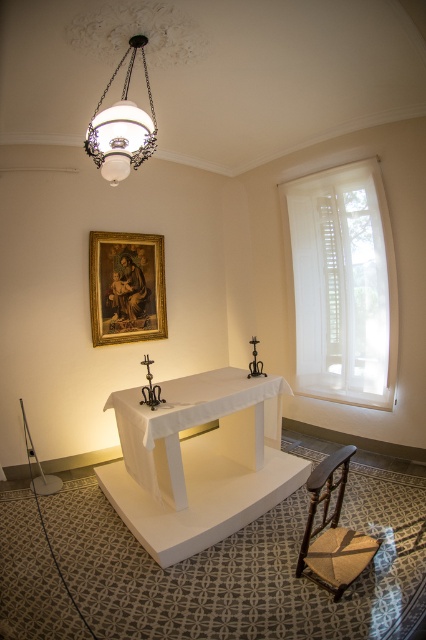
You are standing in the chapel and want to place a small statue between the two points labeled point (98, 275) and point (340, 456). Which point should the statue be closer to if it needs to be placed closer to the camera?

The statue should be placed closer to point (98, 275) because it is further to the camera than point (340, 456).